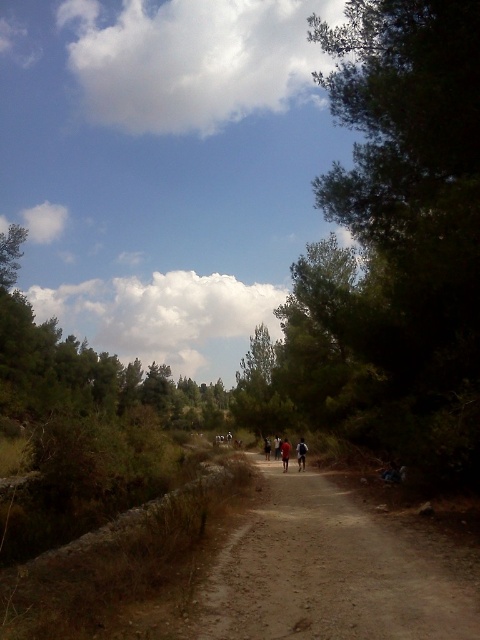
You are standing at the point closer to the camera. Which point are you at, point (286, 436) or point (269, 444)?

You are at point (286, 436) because it is further to the camera than point (269, 444).

You are a hiker carrying a dark blue fabric at center. You want to lay it on the dirt path at center. Will the fabric cover the entire path?

The dirt path at center has a lesser height compared to dark blue fabric at center, so the dark blue fabric at center can cover the entire dirt path at center.